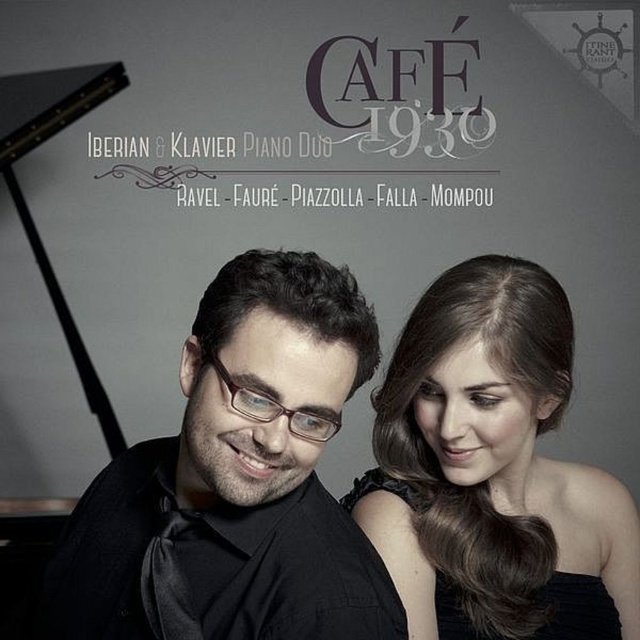
How distant is black matte shirt at center from brown hair at upper right?

They are 14.27 inches apart.

Between black matte shirt at center and brown hair at upper right, which one is positioned higher?

Positioned higher is black matte shirt at center.

Does point (339, 401) come closer to viewer compared to point (616, 500)?

Yes, it is.

You are a GUI agent. You are given a task and a screenshot of the screen. Output one action in this format:
    pyautogui.click(x=<x>, y=<y>)
    Task: Click on the black matte shirt at center
    
    Given the screenshot: What is the action you would take?
    pyautogui.click(x=236, y=481)

Does point (365, 310) come in front of point (570, 579)?

Yes, it is.

Is black matte shirt at center taller than black satin dress at center?

Yes.

Measure the distance between point (45, 582) and camera.

They are 1.01 meters apart.

The height and width of the screenshot is (640, 640). I want to click on black matte shirt at center, so click(236, 481).

Is brown hair at upper right to the left of black satin dress at center from the viewer's perspective?

In fact, brown hair at upper right is to the right of black satin dress at center.

Locate an element on the screen. Image resolution: width=640 pixels, height=640 pixels. brown hair at upper right is located at coordinates (493, 470).

Find the location of a particular element. The width and height of the screenshot is (640, 640). brown hair at upper right is located at coordinates (493, 470).